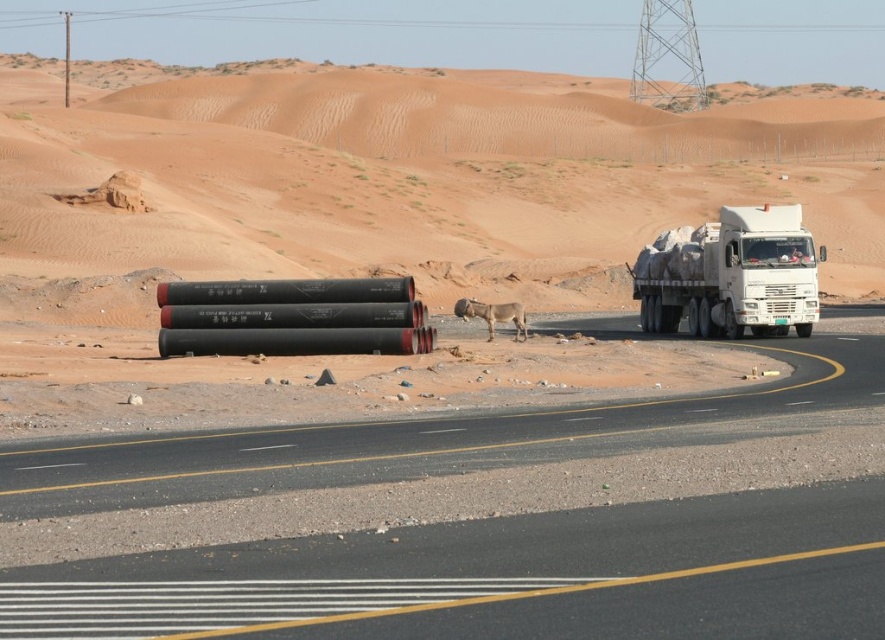
Question: Is black asphalt highway at center smaller than brown furry dog at center?

Choices:
 (A) no
 (B) yes

Answer: (A)

Question: Does brushed metal power line at upper center appear on the right side of brown furry dog at center?

Choices:
 (A) no
 (B) yes

Answer: (A)

Question: Which of these objects is positioned farthest from the brushed metal power line at upper center?

Choices:
 (A) black matte pipes at center
 (B) brown furry dog at center
 (C) black asphalt highway at center

Answer: (C)

Question: Is black asphalt highway at center positioned before white matte truck at right?

Choices:
 (A) yes
 (B) no

Answer: (A)

Question: Which point is closer to the camera?

Choices:
 (A) black matte pipes at center
 (B) brushed metal power line at upper center

Answer: (A)

Question: Which point is farther to the camera?

Choices:
 (A) (204, 13)
 (B) (281, 532)
 (C) (752, 241)
 (D) (45, 301)

Answer: (A)